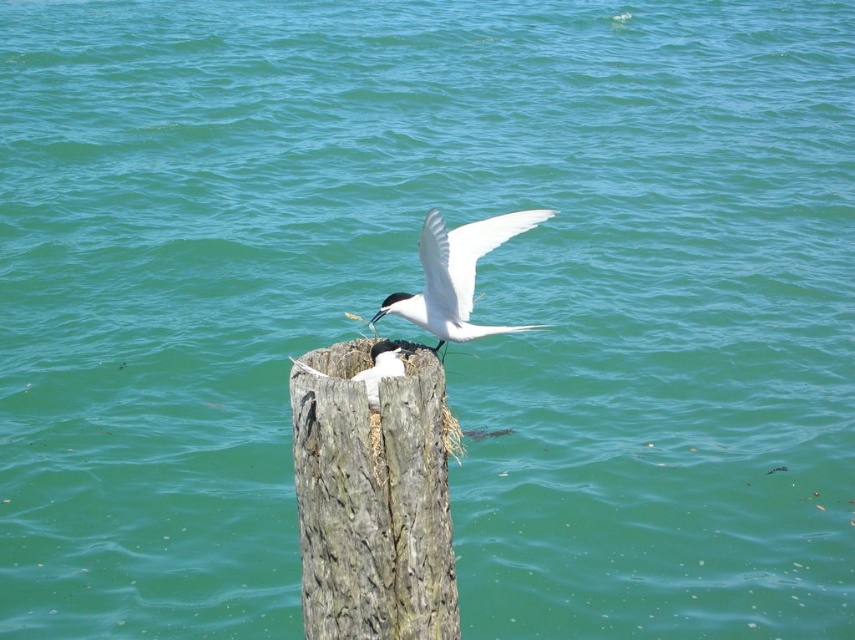
Question: Which object appears farthest from the camera in this image?

Choices:
 (A) white glossy bird at center
 (B) weathered wood stump at center

Answer: (A)

Question: Can you confirm if weathered wood stump at center is positioned above white glossy bird at center?

Choices:
 (A) yes
 (B) no

Answer: (B)

Question: Which point is closer to the camera?

Choices:
 (A) (323, 481)
 (B) (411, 296)

Answer: (A)

Question: Can you confirm if weathered wood stump at center is positioned to the left of white glossy bird at center?

Choices:
 (A) yes
 (B) no

Answer: (A)

Question: Is the position of weathered wood stump at center more distant than that of white glossy bird at center?

Choices:
 (A) no
 (B) yes

Answer: (A)